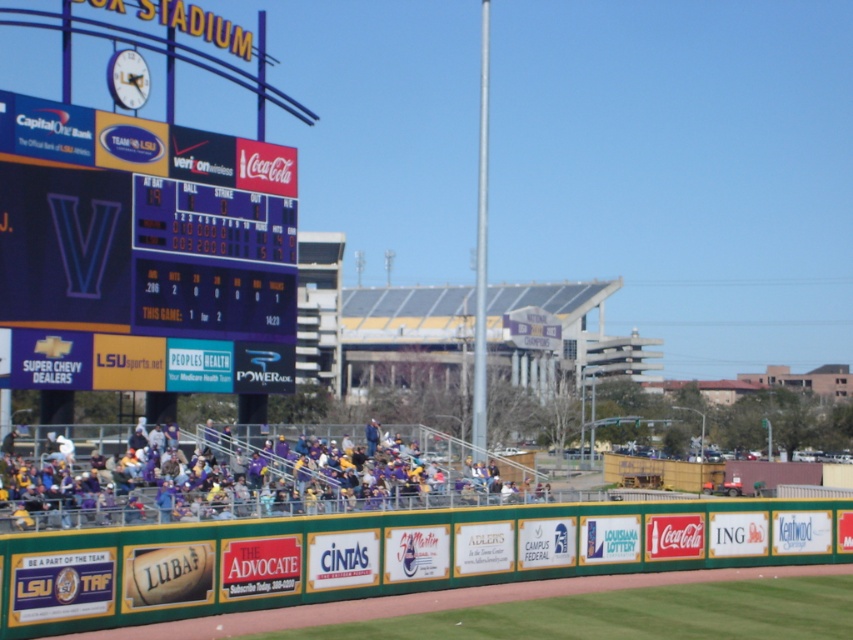
You are a photographer trying to capture a wide shot of the purple glossy scoreboard at left and the purple jersey at center. Based on their sizes, which object should you focus on first to ensure both fit in the frame?

The purple glossy scoreboard at left has a lesser width compared to the purple jersey at center, so you should focus on the purple jersey at center first to accommodate its larger size within the frame.

You are a photographer at the baseball stadium and want to capture the purple glossy scoreboard at left in your photo. The point you are currently focused on is at coordinates point [143,252]. Will this point be on the scoreboard?

Yes, the point [143,252] is on the purple glossy scoreboard at left, so focusing there will capture the scoreboard in your photo.

You are a photographer standing in the outfield of the baseball stadium. You want to take a photo of the purple jersey at center without the purple glossy scoreboard at left blocking it. Is this possible given your current position?

The purple jersey at center is behind the purple glossy scoreboard at left, so it is currently blocked by the scoreboard. To capture the purple jersey at center without obstruction, you would need to reposition yourself to a viewpoint where the jersey is no longer behind the scoreboard.